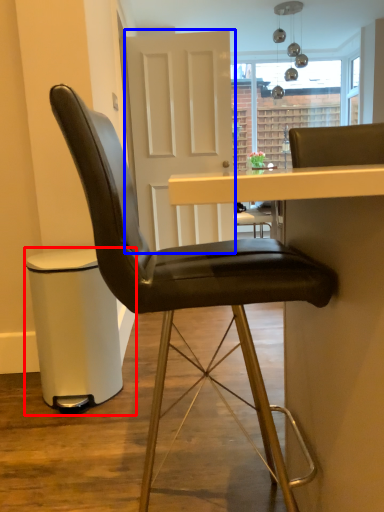
Question: Which object is further to the camera taking this photo, bar stool (highlighted by a red box) or glass door (highlighted by a blue box)?

Choices:
 (A) bar stool
 (B) glass door

Answer: (B)